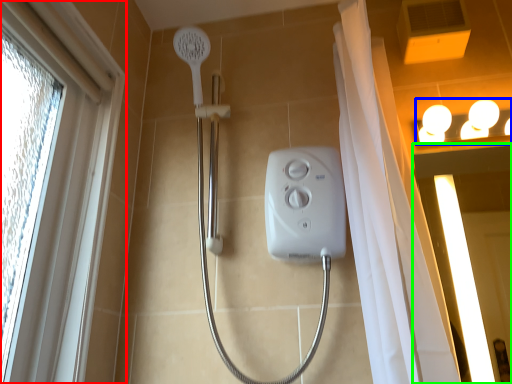
Question: Based on their relative distances, which object is nearer to window (highlighted by a red box)? Choose from light fixture (highlighted by a blue box) and screen door (highlighted by a green box).

Choices:
 (A) light fixture
 (B) screen door

Answer: (A)